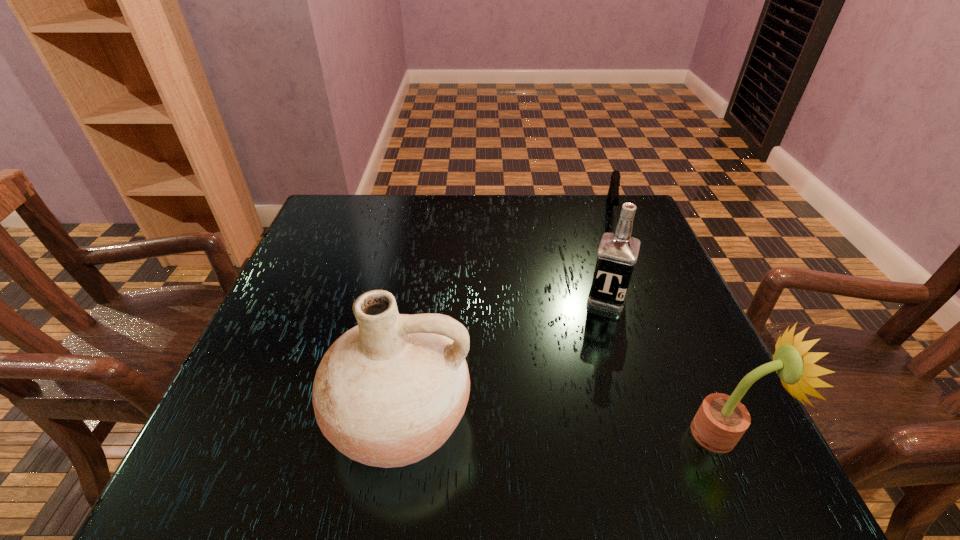
I want to click on the leftmost object, so click(389, 392).

The height and width of the screenshot is (540, 960). Identify the location of sunflower. (720, 422).

You are a GUI agent. You are given a task and a screenshot of the screen. Output one action in this format:
    pyautogui.click(x=<x>, y=<y>)
    Task: Click on the vodka
    
    Given the screenshot: What is the action you would take?
    pyautogui.click(x=617, y=254)

Where is `the third nearest object`? This screenshot has height=540, width=960. the third nearest object is located at coordinates (617, 254).

Identify the location of the shortest object. (613, 193).

Where is `the farthest object`? Image resolution: width=960 pixels, height=540 pixels. the farthest object is located at coordinates (613, 193).

Where is `vacant region located on the front label of the second object from left to right`? This screenshot has width=960, height=540. vacant region located on the front label of the second object from left to right is located at coordinates (596, 339).

The width and height of the screenshot is (960, 540). I want to click on free space located on the front label of the second object from left to right, so click(x=573, y=427).

Where is `free point located 0.050m on the front label of the second object from left to right`? free point located 0.050m on the front label of the second object from left to right is located at coordinates (599, 328).

Where is `vacant point located on the front-facing side of the pistol`? vacant point located on the front-facing side of the pistol is located at coordinates (614, 249).